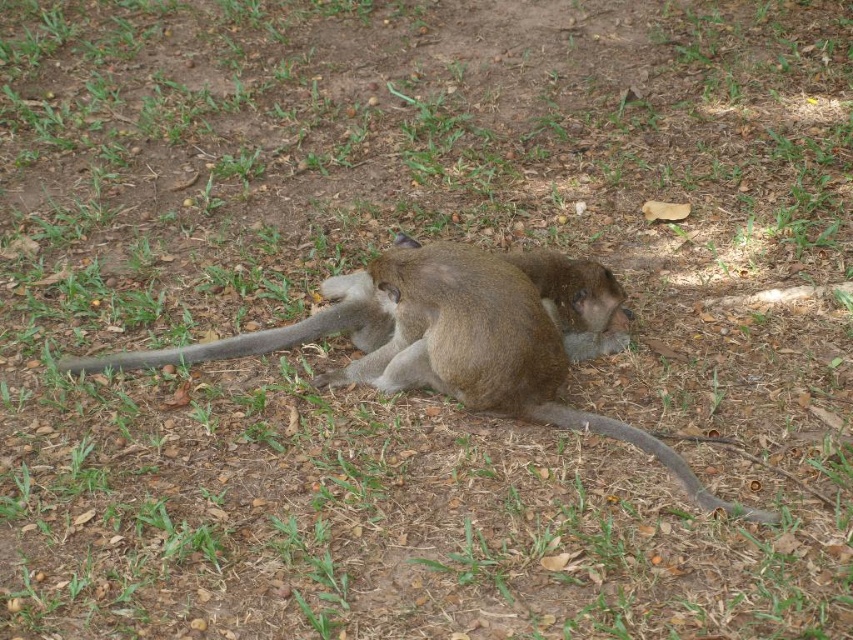
You are a photographer standing at a certain distance from the monkey. You want to take a closeup photo of the gray matte tail at center without any distortion. Considering the camera lens you have can focus clearly at 10 feet, will you need to move closer or farther away from the monkey?

The distance between the gray matte tail at center and the camera is 9.88 feet. Since the camera lens focuses clearly at 10 feet, you are slightly closer than the optimal focusing distance. To avoid distortion, you should move back a little to reach exactly 10 feet.

You are a wildlife photographer trying to capture the brown furry monkey at center and the gray matte tail at center in a single frame. Based on their sizes, which one will occupy more space in your photo?

The brown furry monkey at center has a larger size compared to the gray matte tail at center, so it will occupy more space in the photo.